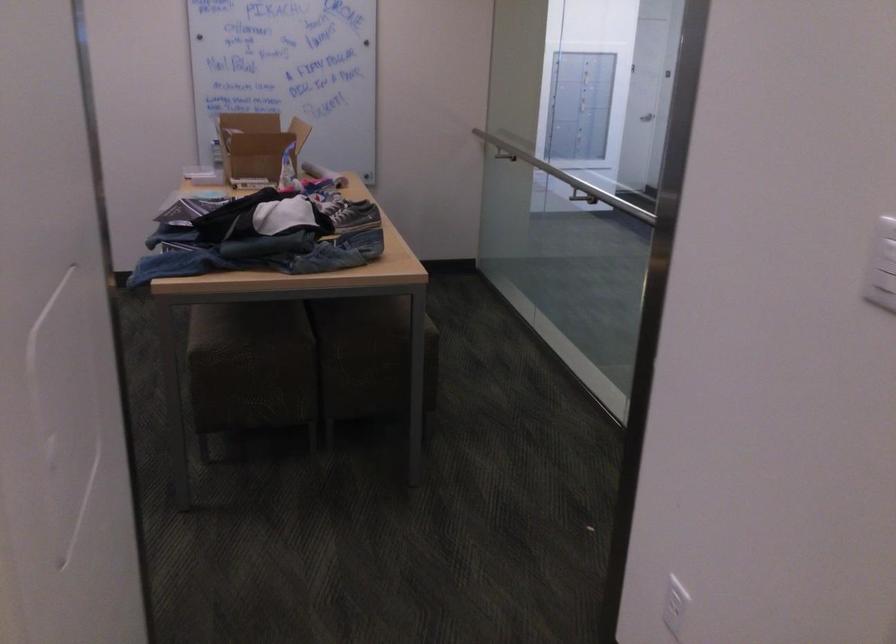
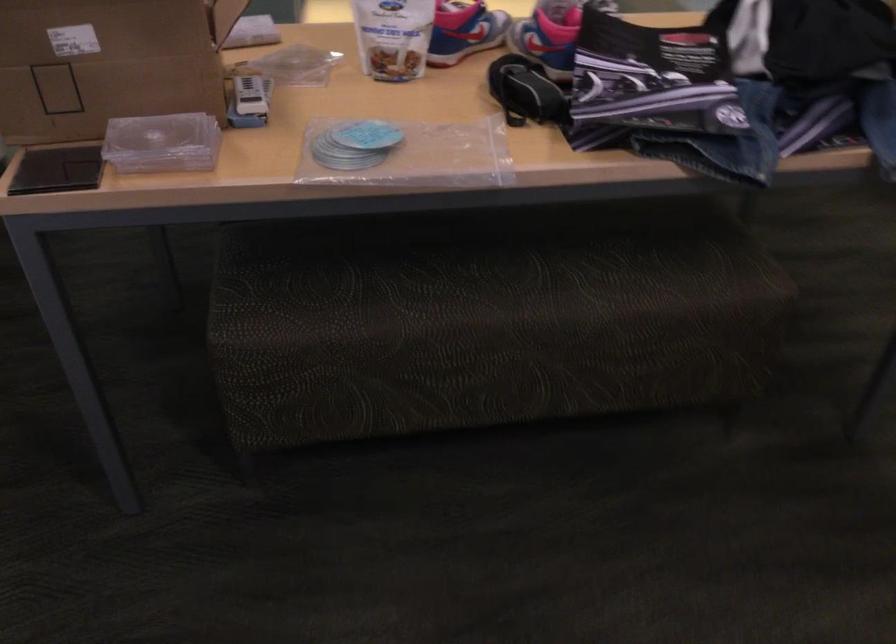
Question: I am providing you with two images of the same scene from different viewpoints. After the viewpoint changes to image2, which objects are now occluded?

Choices:
 (A) glass carafe
 (B) stool sitting surface
 (C) blue and pink sneaker
 (D) cardboard box

Answer: (B)